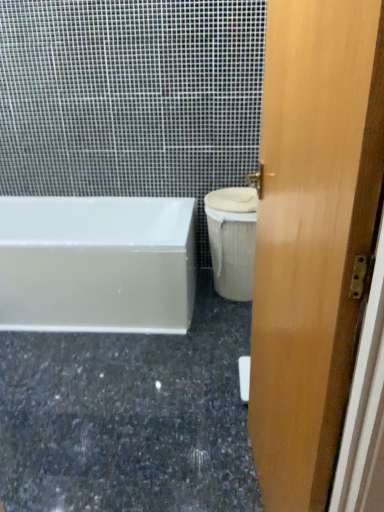
Question: From the image's perspective, is white fabric-covered toilet bowl at right located above or below white glossy bathtub at left?

Choices:
 (A) below
 (B) above

Answer: (B)

Question: Considering the positions of point (220, 227) and point (132, 295), is point (220, 227) closer or farther from the camera than point (132, 295)?

Choices:
 (A) closer
 (B) farther

Answer: (B)

Question: Which of these objects is positioned farthest from the granite at lower left?

Choices:
 (A) white fabric-covered toilet bowl at right
 (B) light brown wood door at right
 (C) white glossy bathtub at left

Answer: (B)

Question: Which is nearer to the light brown wood door at right?

Choices:
 (A) granite at lower left
 (B) white fabric-covered toilet bowl at right
 (C) white glossy bathtub at left

Answer: (A)